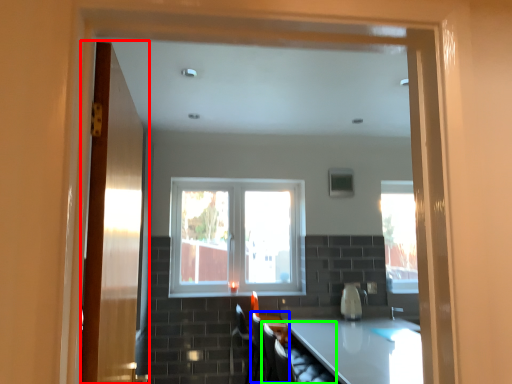
Question: Which is nearer to the door (highlighted by a red box)? armchair (highlighted by a blue box) or armchair (highlighted by a green box).

Choices:
 (A) armchair
 (B) armchair

Answer: (B)